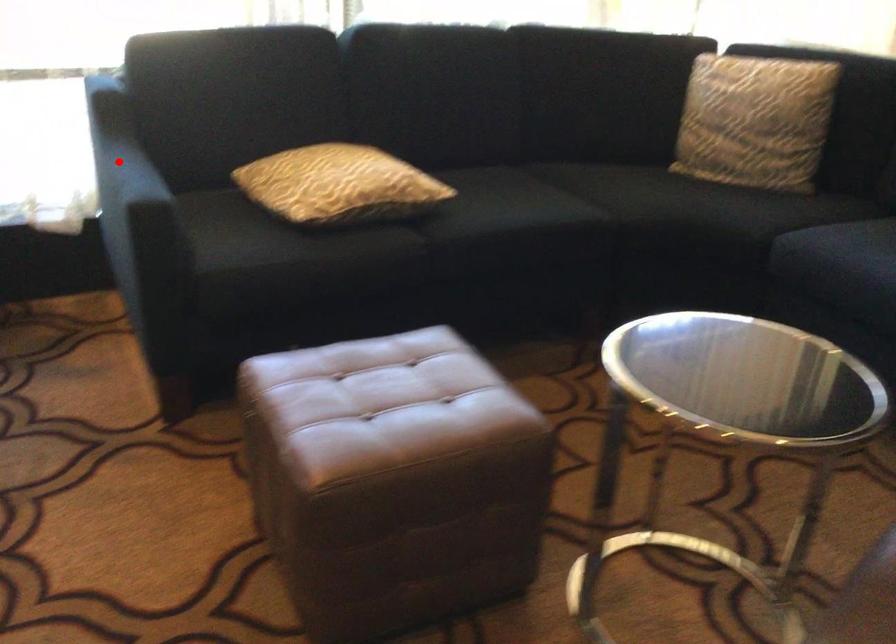
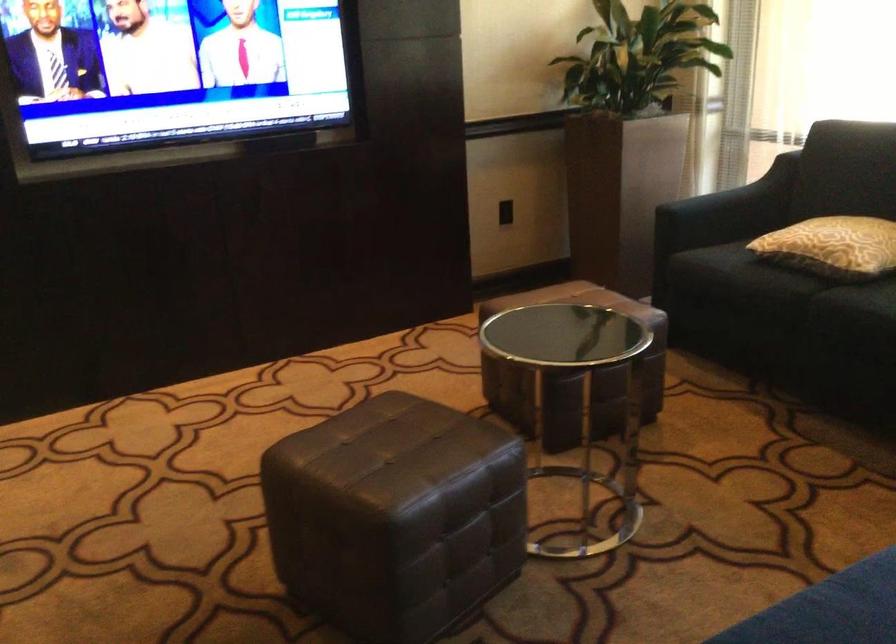
Question: I am providing you with two images of the same scene from different viewpoints. Given a red point in image1, look at the same physical point in image2. Is it:

Choices:
 (A) Closer to the viewpoint
 (B) Farther from the viewpoint

Answer: (B)